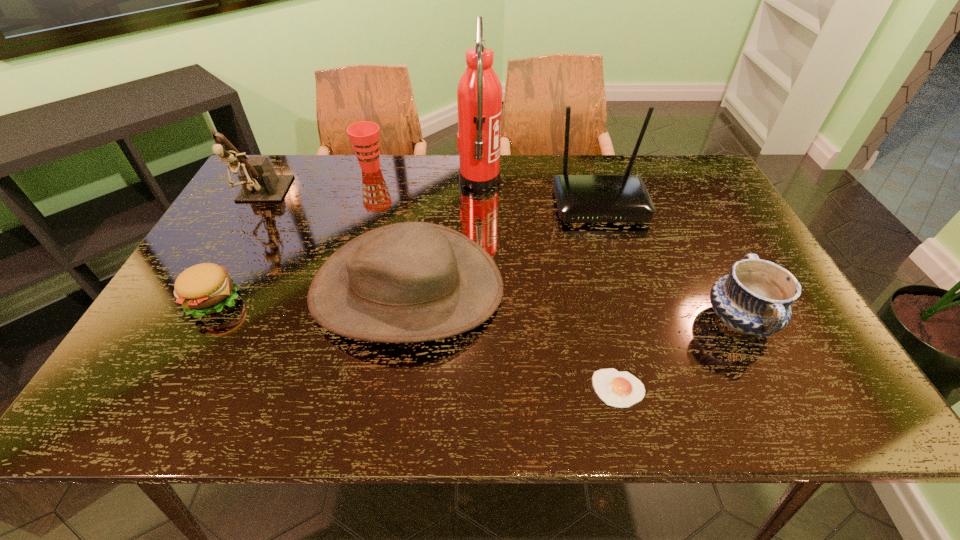
This screenshot has width=960, height=540. I want to click on free location that satisfies the following two spatial constraints: 1. on the label side of the tallest object; 2. on the right side of the rightmost object, so click(x=479, y=320).

Where is `free spot that satisfies the following two spatial constraints: 1. on the label side of the pottery; 2. on the right side of the fire extinguisher`? free spot that satisfies the following two spatial constraints: 1. on the label side of the pottery; 2. on the right side of the fire extinguisher is located at coordinates click(x=479, y=320).

I want to click on vacant position in the image that satisfies the following two spatial constraints: 1. on the front-facing side of the figurine; 2. on the right side of the seventh tallest object, so click(x=201, y=300).

Find the location of a particular element. vacant region that satisfies the following two spatial constraints: 1. on the label side of the fire extinguisher; 2. on the left side of the rightmost object is located at coordinates (479, 320).

At what (x,y) coordinates should I click in order to perform the action: click on free space that satisfies the following two spatial constraints: 1. on the label side of the tallest object; 2. on the left side of the pottery. Please return your answer as a coordinate pair (x, y). This screenshot has height=540, width=960. Looking at the image, I should click on (479, 320).